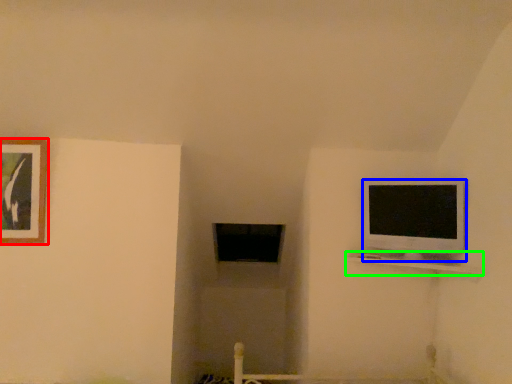
Question: Considering the real-world distances, which object is closest to picture frame (highlighted by a red box)? television (highlighted by a blue box) or shelf (highlighted by a green box).

Choices:
 (A) television
 (B) shelf

Answer: (B)